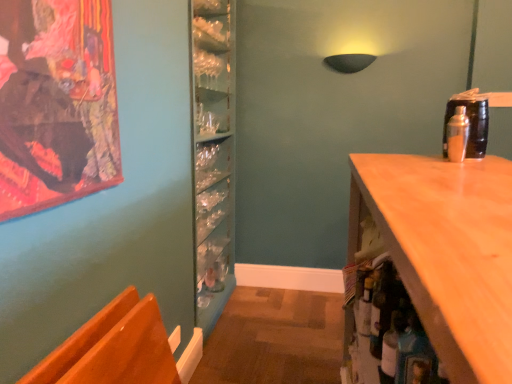
Question: Is translucent glass bottle at lower right, which is the first bottle from front to back, surrounded by shiny orange chair at lower left?

Choices:
 (A) yes
 (B) no

Answer: (B)

Question: Is translucent glass bottle at lower right, the second bottle positioned from the back, at the back of shiny orange chair at lower left?

Choices:
 (A) yes
 (B) no

Answer: (B)

Question: Could you tell me if shiny orange chair at lower left is turned towards translucent glass bottle at lower right, which appears as the first bottle when ordered from the bottom?

Choices:
 (A) no
 (B) yes

Answer: (B)

Question: Is shiny orange chair at lower left to the right of translucent glass bottle at lower right, which appears as the second bottle when viewed from the right, from the viewer's perspective?

Choices:
 (A) no
 (B) yes

Answer: (A)

Question: Does shiny orange chair at lower left have a greater width compared to translucent glass bottle at lower right, which appears as the first bottle when ordered from the bottom?

Choices:
 (A) yes
 (B) no

Answer: (A)

Question: From the image's perspective, is shiny orange chair at lower left located beneath translucent glass bottle at lower right, which appears as the first bottle when ordered from the bottom?

Choices:
 (A) no
 (B) yes

Answer: (B)

Question: Can you confirm if translucent glass bottle at lower right, the second bottle positioned from the back, is bigger than shiny orange chair at lower left?

Choices:
 (A) no
 (B) yes

Answer: (A)

Question: Is translucent glass bottle at lower right, which appears as the 1th bottle when viewed from the left, not close to shiny orange chair at lower left?

Choices:
 (A) no
 (B) yes

Answer: (A)

Question: Is translucent glass bottle at lower right, which ranks as the 2th bottle in top-to-bottom order, completely or partially outside of shiny orange chair at lower left?

Choices:
 (A) yes
 (B) no

Answer: (A)

Question: From a real-world perspective, is translucent glass bottle at lower right, the second bottle positioned from the back, on top of shiny orange chair at lower left?

Choices:
 (A) no
 (B) yes

Answer: (B)

Question: Is translucent glass bottle at lower right, which ranks as the 2th bottle in top-to-bottom order, at the left side of shiny orange chair at lower left?

Choices:
 (A) yes
 (B) no

Answer: (B)

Question: Is translucent glass bottle at lower right, the second bottle positioned from the back, looking in the opposite direction of shiny orange chair at lower left?

Choices:
 (A) yes
 (B) no

Answer: (B)

Question: Is metallic silver shaker at upper right, the second bottle ordered from the bottom, to the right of shiny orange chair at lower left from the viewer's perspective?

Choices:
 (A) yes
 (B) no

Answer: (A)